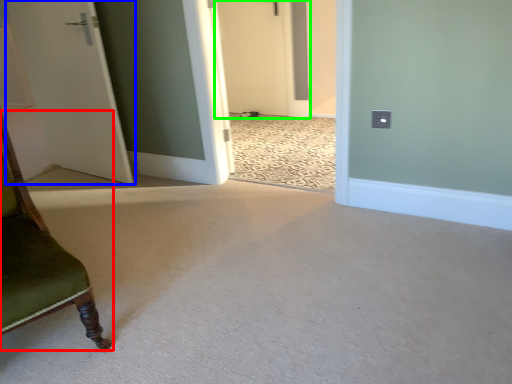
Question: Based on their relative distances, which object is farther from furniture (highlighted by a red box)? Choose from door (highlighted by a blue box) and door (highlighted by a green box).

Choices:
 (A) door
 (B) door

Answer: (B)